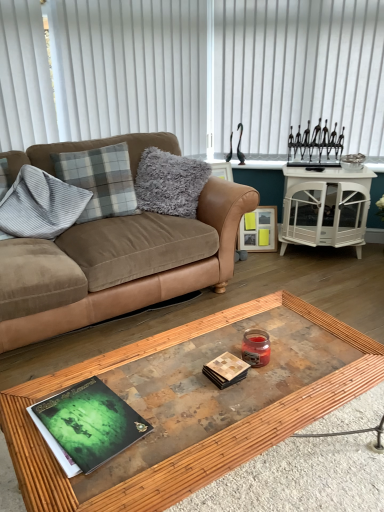
At what (x,y) coordinates should I click in order to perform the action: click on blank space above wooden glass coffee table at center (from a real-world perspective). Please return your answer as a coordinate pair (x, y). Looking at the image, I should click on (210, 384).